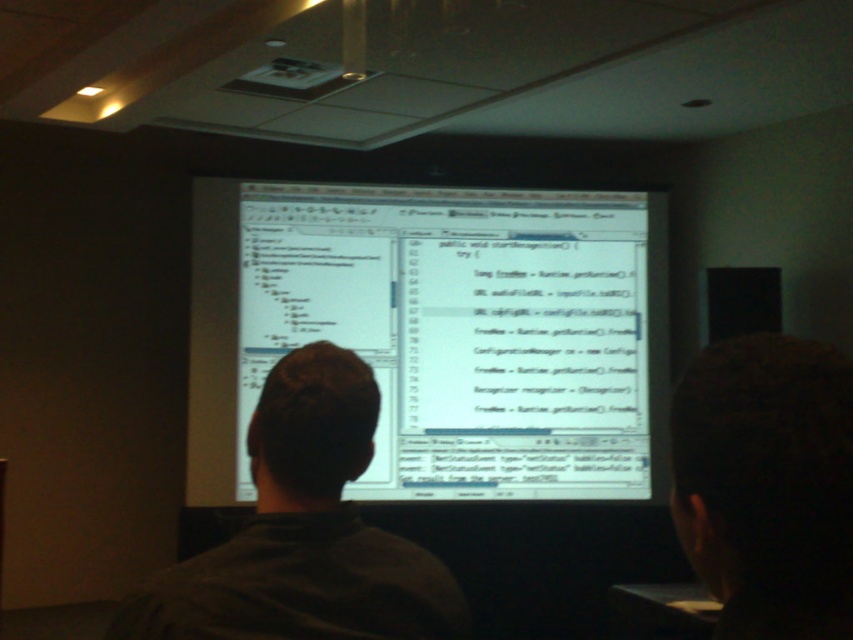
Which is below, white glossy computer monitor at center or dark gray shirt at center?

Positioned lower is dark gray shirt at center.

Identify the location of white glossy computer monitor at center. The width and height of the screenshot is (853, 640). (440, 332).

Which is behind, point (247, 252) or point (294, 396)?

The point (247, 252) is more distant.

Image resolution: width=853 pixels, height=640 pixels. I want to click on white glossy computer monitor at center, so click(x=440, y=332).